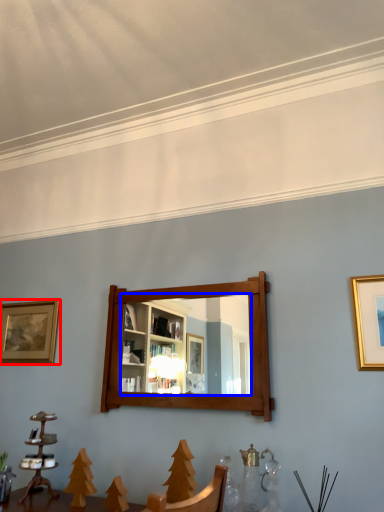
Question: Which of the following is the closest to the observer, picture frame (highlighted by a red box) or mirror (highlighted by a blue box)?

Choices:
 (A) picture frame
 (B) mirror

Answer: (B)